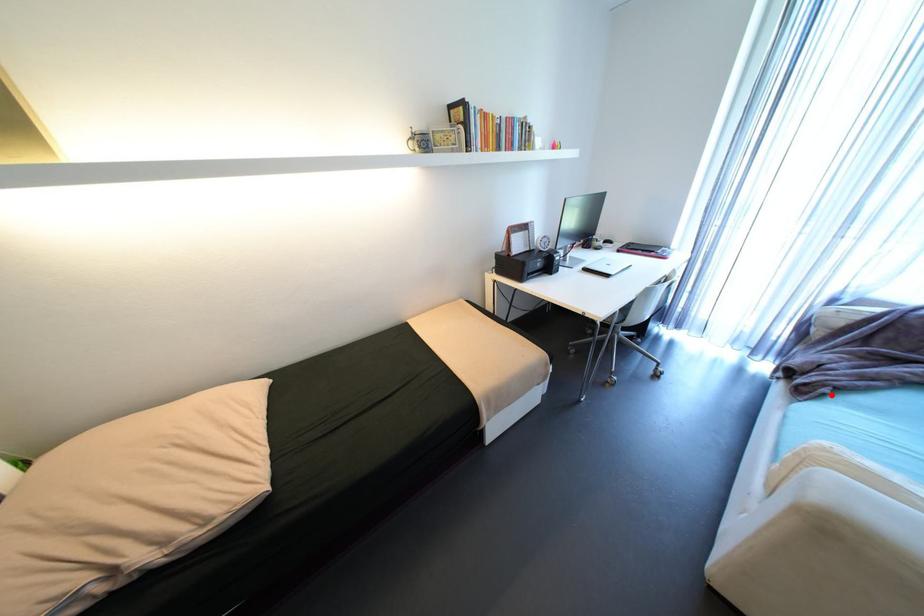
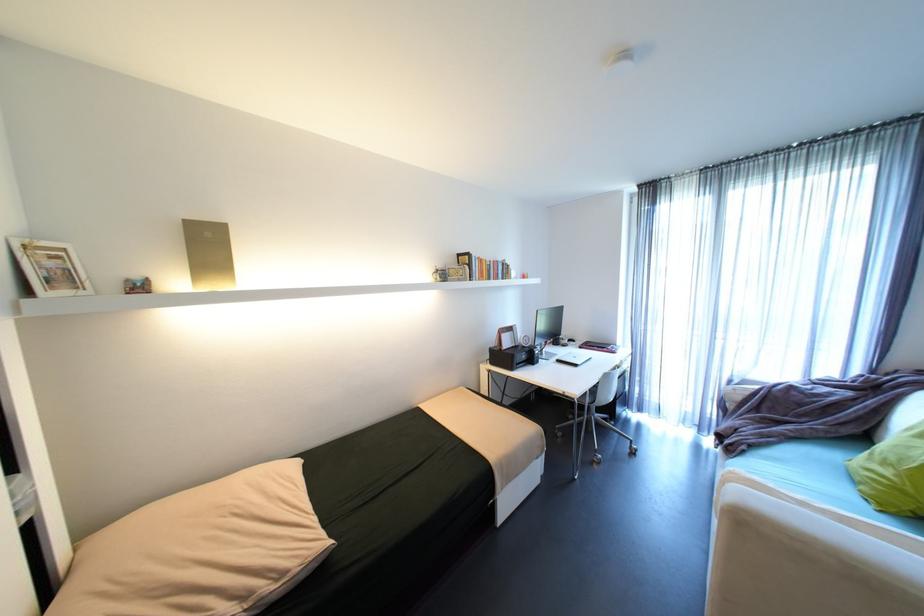
Where in the second image is the point corresponding to the highlighted location from the first image?

(751, 451)